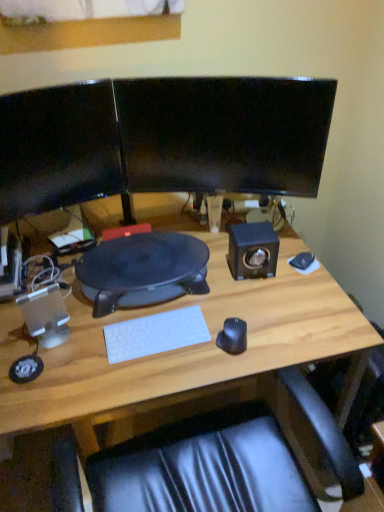
Where is `free spot to the right of white matte keyboard at center`? The height and width of the screenshot is (512, 384). free spot to the right of white matte keyboard at center is located at coordinates (221, 332).